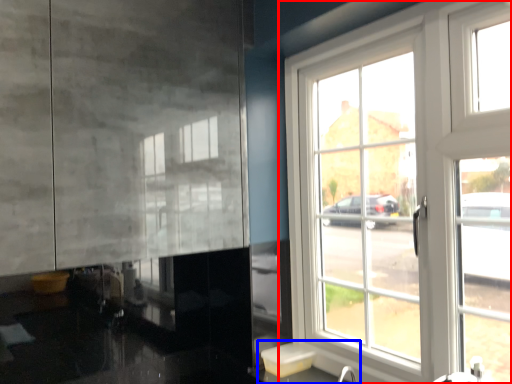
Question: Which point is closer to the camera, window (highlighted by a red box) or sink (highlighted by a blue box)?

Choices:
 (A) window
 (B) sink

Answer: (B)